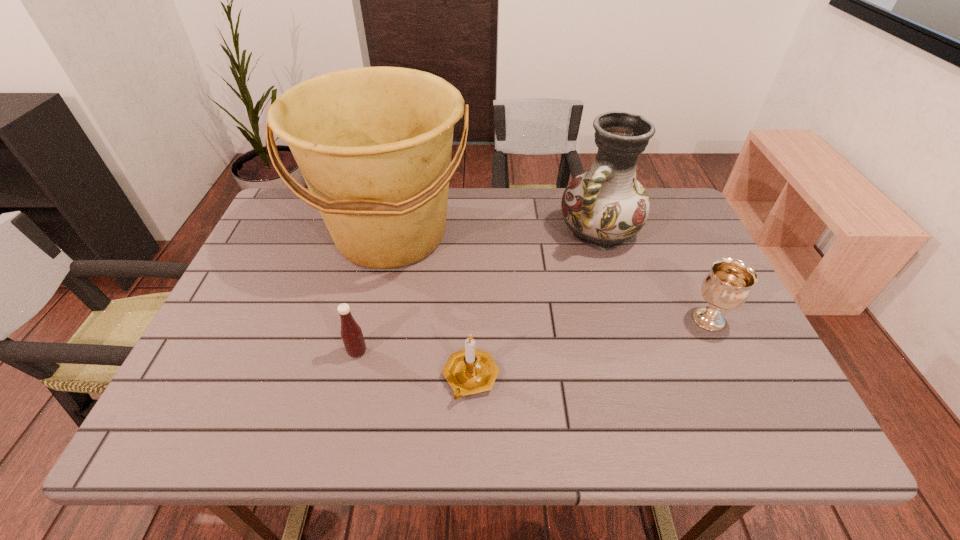
Where is `vacant space at the far edge`? The height and width of the screenshot is (540, 960). vacant space at the far edge is located at coordinates (492, 193).

The width and height of the screenshot is (960, 540). I want to click on blank space at the near edge of the desktop, so click(x=661, y=436).

You are a GUI agent. You are given a task and a screenshot of the screen. Output one action in this format:
    pyautogui.click(x=<x>, y=<y>)
    Task: Click on the free region at the left edge
    
    Given the screenshot: What is the action you would take?
    pyautogui.click(x=207, y=365)

Where is `vacant space at the right edge`? This screenshot has width=960, height=540. vacant space at the right edge is located at coordinates (688, 286).

I want to click on vacant area at the far left corner, so click(303, 222).

Where is `vacant space at the far right corner of the desktop`? The height and width of the screenshot is (540, 960). vacant space at the far right corner of the desktop is located at coordinates (660, 191).

Find the location of `empty space that is in between the candle holder and the tallest object`. empty space that is in between the candle holder and the tallest object is located at coordinates (431, 306).

I want to click on free space between the tallest object and the candle holder, so click(431, 306).

Locate an element on the screen. This screenshot has height=540, width=960. free point between the tallest object and the second object from right to left is located at coordinates (495, 234).

Locate an element on the screen. This screenshot has height=540, width=960. vacant area that lies between the bucket and the candle holder is located at coordinates (431, 306).